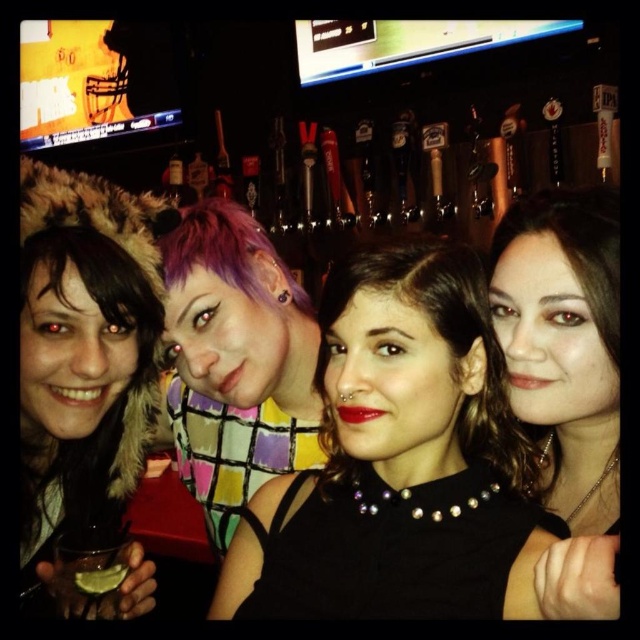
Question: Does brown shiny hair at center have a smaller size compared to translucent plastic cup at lower left?

Choices:
 (A) no
 (B) yes

Answer: (A)

Question: Which of these objects is positioned closest to the dark brown fur at left?

Choices:
 (A) translucent plastic cup at lower left
 (B) clear glass at lower left

Answer: (B)

Question: Can you confirm if dark brown fur at left is positioned to the right of clear glass at lower left?

Choices:
 (A) yes
 (B) no

Answer: (B)

Question: Which point is farther to the camera?

Choices:
 (A) (106, 570)
 (B) (307, 589)

Answer: (A)

Question: Which object is the closest to the dark brown fur at left?

Choices:
 (A) clear glass at lower left
 (B) black pearl necklace at center
 (C) matte black necklace at center

Answer: (A)

Question: Considering the relative positions of brown shiny hair at center and translucent plastic cup at lower left in the image provided, where is brown shiny hair at center located with respect to translucent plastic cup at lower left?

Choices:
 (A) right
 (B) left

Answer: (A)